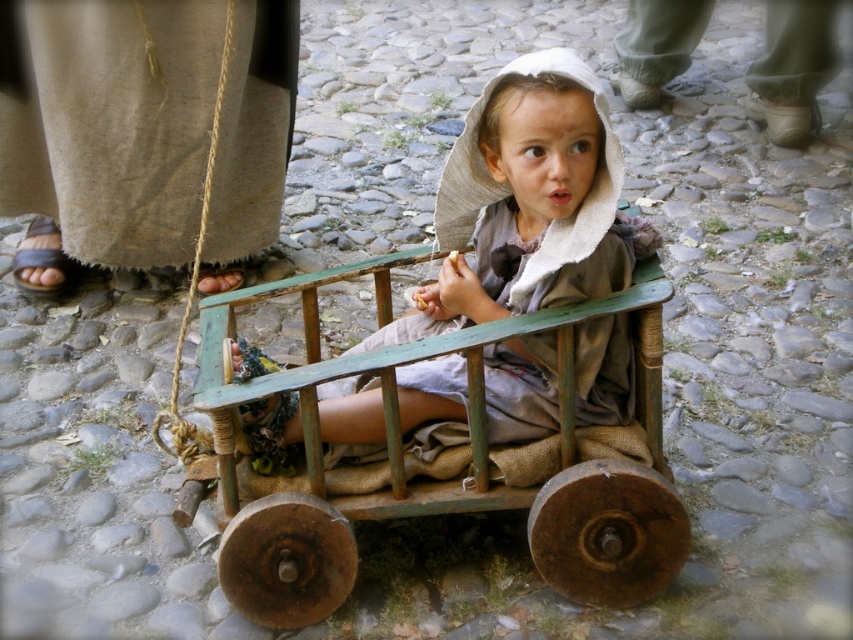
You are a delivery person trying to move a heavy box from the matte green cart at center to the green painted wood wagon at center. Which direction should you move the box to place it on the wagon?

The matte green cart at center is behind the green painted wood wagon at center, so you should move the box forward towards the green painted wood wagon at center to place it on the wagon.

You are a parent trying to choose between the green painted wood wagon at center and the matte green cart at center for your child. Based on the height of the two carts, which one would be more stable for your child to sit in?

The green painted wood wagon at center has a greater height compared to matte green cart at center, so it would be more stable for the child to sit in because higher carts typically provide better stability.

You are a parent trying to push your child in the green painted wood wagon at center and the matte green cart at center. Which one is lower to the ground?

The green painted wood wagon at center is lower to the ground than the matte green cart at center.